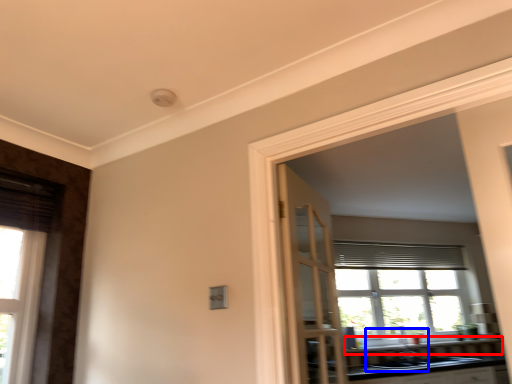
Question: Among these objects, which one is farthest to the camera, window sill (highlighted by a red box) or sink (highlighted by a blue box)?

Choices:
 (A) window sill
 (B) sink

Answer: (A)